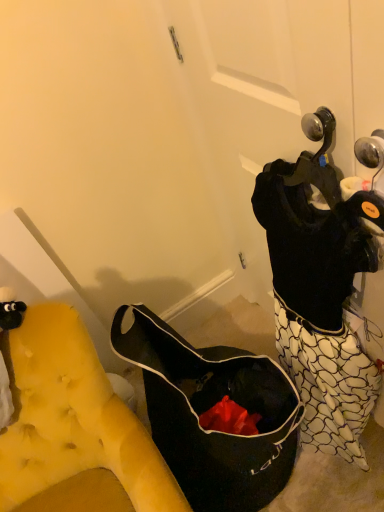
Question: Is yellow tufted fabric at left spatially inside black fabric bag at lower left, or outside of it?

Choices:
 (A) outside
 (B) inside

Answer: (A)

Question: Is yellow tufted fabric at left taller or shorter than black fabric bag at lower left?

Choices:
 (A) tall
 (B) short

Answer: (A)

Question: Based on their positions, is yellow tufted fabric at left located to the left or right of black fabric bag at lower left?

Choices:
 (A) left
 (B) right

Answer: (A)

Question: In terms of width, does black fabric bag at lower left look wider or thinner when compared to yellow tufted fabric at left?

Choices:
 (A) thin
 (B) wide

Answer: (B)

Question: Considering their positions, is black fabric bag at lower left located in front of or behind yellow tufted fabric at left?

Choices:
 (A) front
 (B) behind

Answer: (B)

Question: In the image, is black fabric bag at lower left on the left side or the right side of yellow tufted fabric at left?

Choices:
 (A) right
 (B) left

Answer: (A)

Question: Does point coord(130,352) appear closer or farther from the camera than point coord(61,348)?

Choices:
 (A) farther
 (B) closer

Answer: (A)